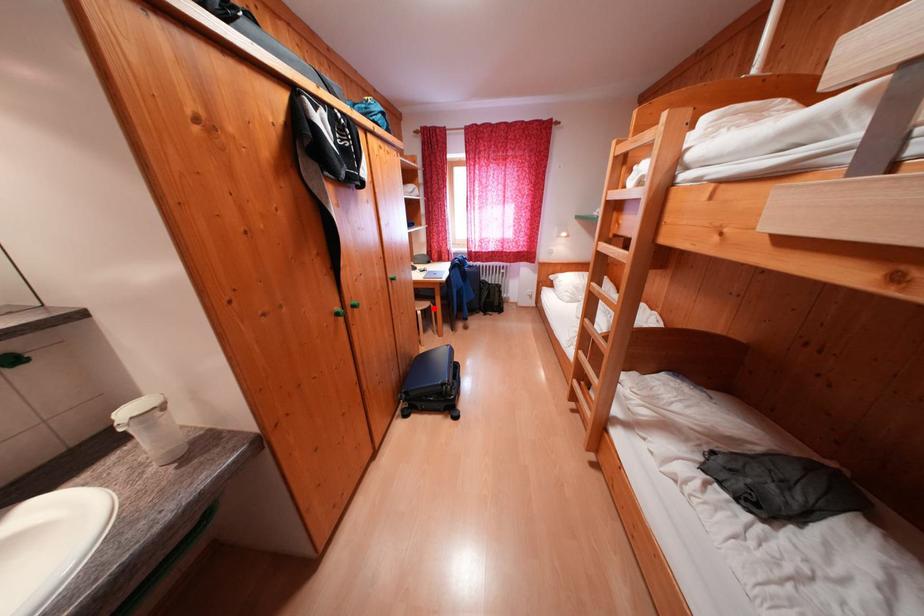
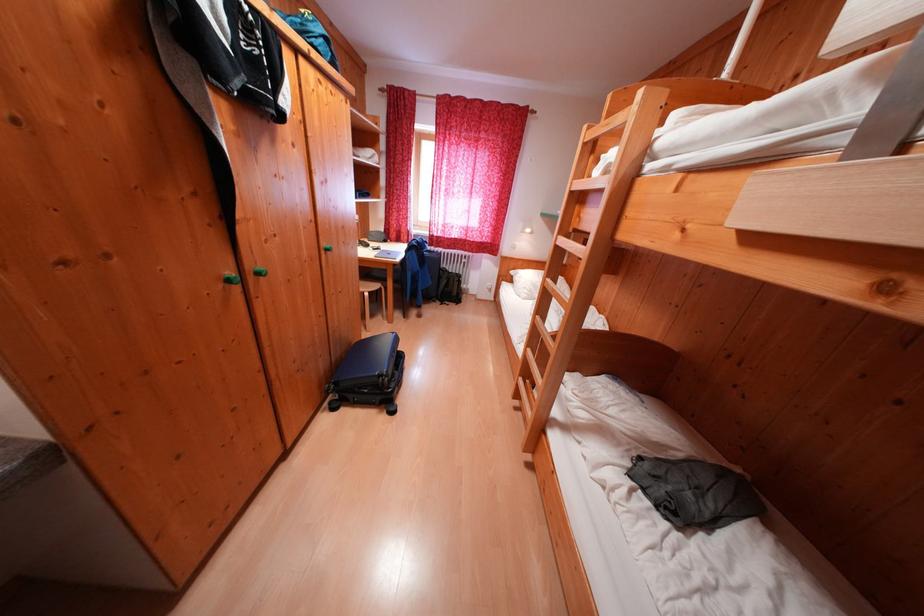
Question: I am providing you with two images of the same scene from different viewpoints. Given a red point in image1, look at the same physical point in image2. Is it:

Choices:
 (A) Closer to the viewpoint
 (B) Farther from the viewpoint

Answer: (B)